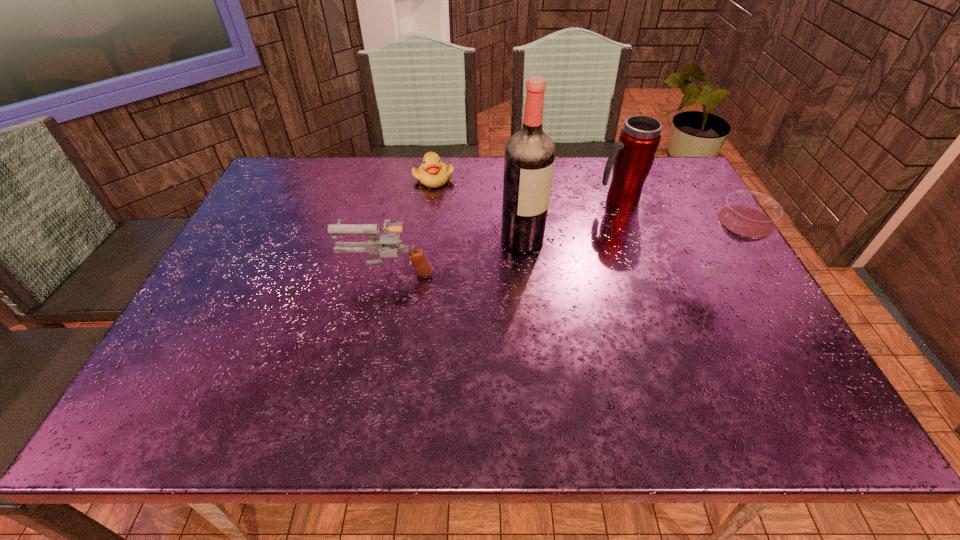
This screenshot has height=540, width=960. What are the coordinates of `vacant region located on the side with the handle of the fourth shortest object` in the screenshot? It's located at (560, 292).

At what (x,y) coordinates should I click in order to perform the action: click on free space located on the side with the handle of the fourth shortest object. Please return your answer as a coordinate pair (x, y). Looking at the image, I should click on (598, 229).

I want to click on duckling present at the far edge, so click(432, 173).

At what (x,y) coordinates should I click in order to perform the action: click on thermos bottle positioned at the far edge. Please return your answer as a coordinate pair (x, y). Looking at the image, I should click on (632, 156).

You are a GUI agent. You are given a task and a screenshot of the screen. Output one action in this format:
    pyautogui.click(x=<x>, y=<y>)
    Task: Click on the object that is at the right edge
    
    Given the screenshot: What is the action you would take?
    pyautogui.click(x=747, y=216)

At what (x,y) coordinates should I click in order to perform the action: click on free space at the far edge. Please return your answer as a coordinate pair (x, y). Image resolution: width=960 pixels, height=540 pixels. Looking at the image, I should click on (342, 165).

In the image, there is a desktop. Identify the location of free space at the near edge. The height and width of the screenshot is (540, 960). (383, 375).

The image size is (960, 540). In order to click on free space at the left edge of the desktop in this screenshot , I will do `click(306, 216)`.

You are a GUI agent. You are given a task and a screenshot of the screen. Output one action in this format:
    pyautogui.click(x=<x>, y=<y>)
    Task: Click on the vacant region at the right edge of the desktop
    This screenshot has width=960, height=540.
    Given the screenshot: What is the action you would take?
    pyautogui.click(x=711, y=320)

The height and width of the screenshot is (540, 960). In the image, there is a desktop. In order to click on vacant space at the near left corner in this screenshot , I will do `click(206, 368)`.